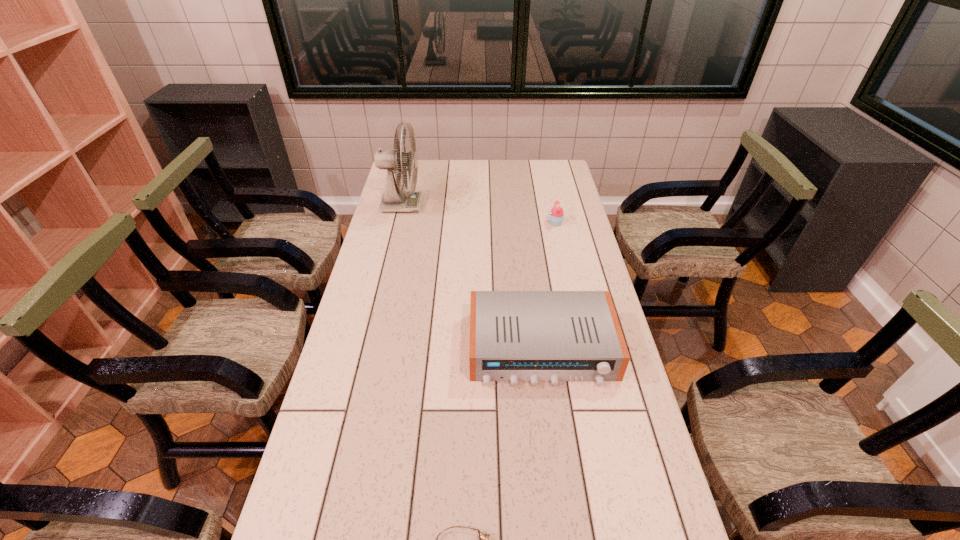
Where is `fan`? fan is located at coordinates (393, 200).

I want to click on the leftmost object, so click(393, 200).

Locate an element on the screen. The image size is (960, 540). radio receiver is located at coordinates (534, 336).

Locate an element on the screen. cupcake is located at coordinates pyautogui.click(x=556, y=217).

Where is `blank area located 0.340m on the front-facing side of the tallest object`? The image size is (960, 540). blank area located 0.340m on the front-facing side of the tallest object is located at coordinates (503, 205).

Identify the location of vacant space situated 0.120m on the control panel of the second nearest object. Image resolution: width=960 pixels, height=540 pixels. (552, 430).

Where is `free space located 0.170m on the face of the cupcake`? This screenshot has height=540, width=960. free space located 0.170m on the face of the cupcake is located at coordinates (506, 223).

Locate an element on the screen. free space located 0.300m on the face of the cupcake is located at coordinates (472, 223).

Identify the location of vacant area situated 0.210m on the face of the cupcake. (495, 223).

Image resolution: width=960 pixels, height=540 pixels. Find the location of `object located at the left edge`. object located at the left edge is located at coordinates (393, 200).